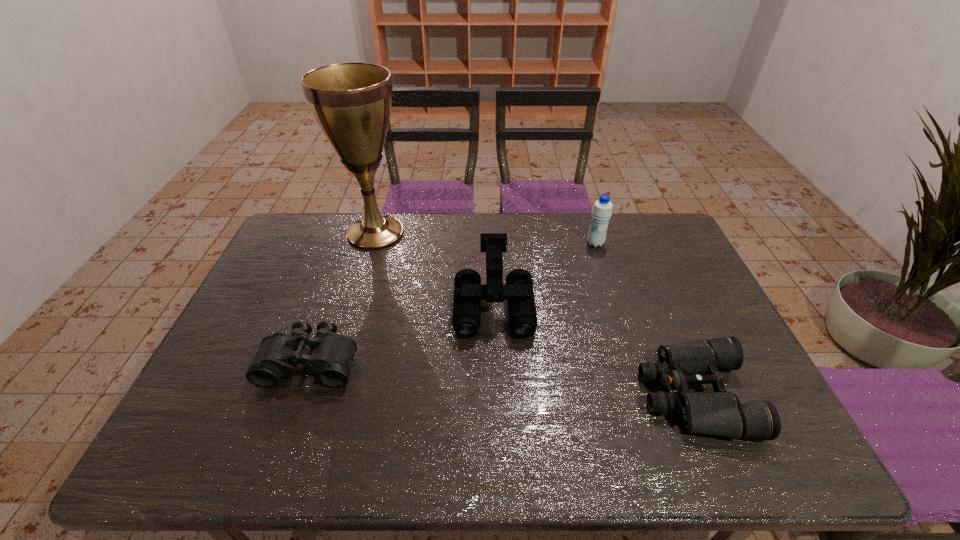
In the image, there is a desktop. Where is `free space at the near edge`? free space at the near edge is located at coordinates (542, 454).

Identify the location of free location at the right edge of the desktop. (676, 300).

In order to click on free space at the far right corner of the desktop in this screenshot , I will do `click(627, 226)`.

This screenshot has height=540, width=960. Find the location of `vacant point located between the leftmost binoculars and the water bottle`. vacant point located between the leftmost binoculars and the water bottle is located at coordinates (453, 303).

Identify the location of empty location between the second binoculars from right to left and the rightmost binoculars. (594, 350).

What are the coordinates of `free space that is in between the rightmost binoculars and the third shortest object` in the screenshot? It's located at (594, 350).

Where is `free point between the water bottle and the leftmost binoculars`? free point between the water bottle and the leftmost binoculars is located at coordinates (453, 303).

This screenshot has height=540, width=960. Find the location of `vacant area that lies between the tallest object and the leftmost binoculars`. vacant area that lies between the tallest object and the leftmost binoculars is located at coordinates (344, 298).

The image size is (960, 540). What are the coordinates of `free space between the rightmost binoculars and the water bottle` in the screenshot? It's located at (644, 319).

Locate an element on the screen. The image size is (960, 540). free area in between the water bottle and the tallest binoculars is located at coordinates (544, 274).